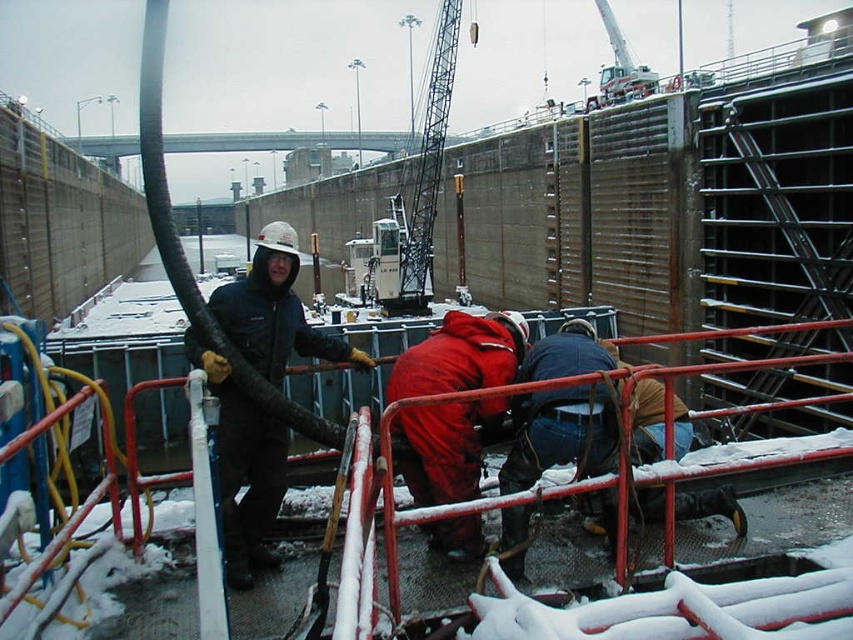
Question: Considering the relative positions of red matte jumpsuit at center and white metal crane at center in the image provided, where is red matte jumpsuit at center located with respect to white metal crane at center?

Choices:
 (A) below
 (B) above

Answer: (A)

Question: Does red matte jumpsuit at center appear under white metal crane at center?

Choices:
 (A) no
 (B) yes

Answer: (B)

Question: Can you confirm if red matte jumpsuit at center is wider than white metal crane at center?

Choices:
 (A) no
 (B) yes

Answer: (A)

Question: Which point is closer to the camera?

Choices:
 (A) white metal crane at center
 (B) red matte jumpsuit at center

Answer: (B)